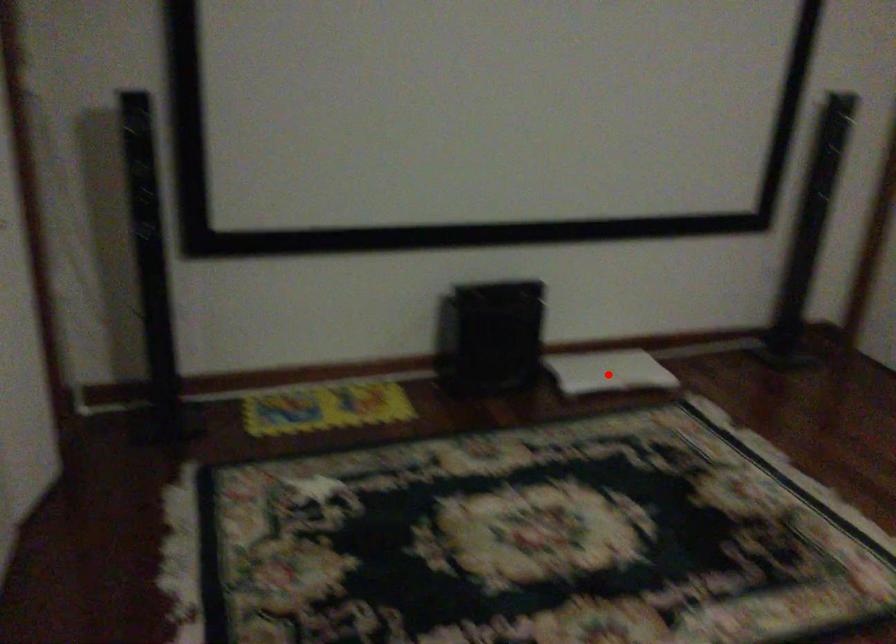
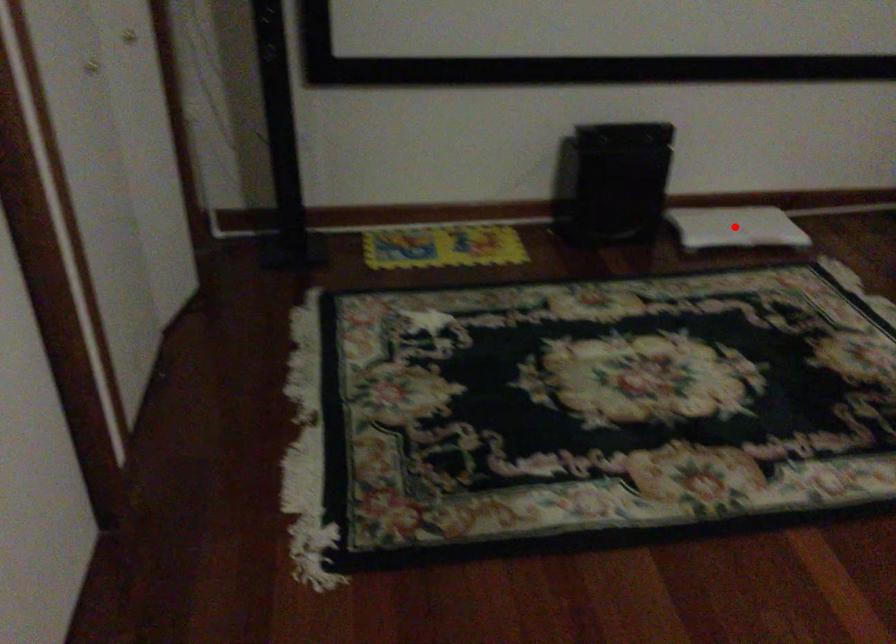
I am providing you with two images of the same scene from different viewpoints. A red point is marked on the first image and another point is marked on the second image. Are the points marked in image1 and image2 representing the same 3D position?

Yes